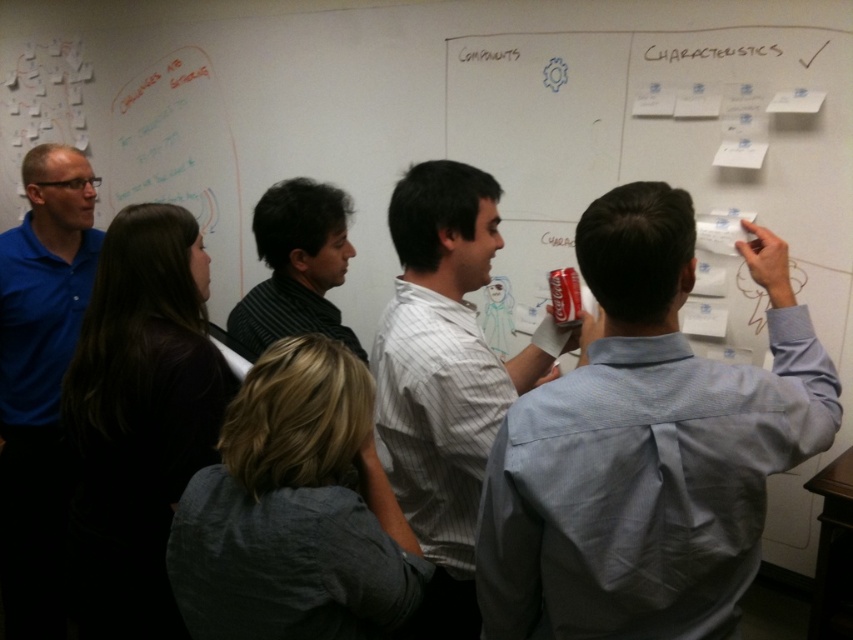
Is white striped shirt at center to the left of blue cotton polo shirt at left from the viewer's perspective?

In fact, white striped shirt at center is to the right of blue cotton polo shirt at left.

Is point (398, 216) positioned before point (33, 205)?

Yes, it is.

This screenshot has height=640, width=853. I want to click on white striped shirt at center, so click(x=444, y=376).

Between light blue shirt at center and gray cotton shirt at center, which one has more height?

With more height is light blue shirt at center.

Who is more forward, (x=554, y=484) or (x=389, y=611)?

Point (x=554, y=484) is in front.

The image size is (853, 640). In order to click on light blue shirt at center in this screenshot , I will do `click(647, 445)`.

Based on the photo, does light blue shirt at center have a lesser width compared to striped shirt at center?

No, light blue shirt at center is not thinner than striped shirt at center.

Locate an element on the screen. The width and height of the screenshot is (853, 640). light blue shirt at center is located at coordinates (647, 445).

The width and height of the screenshot is (853, 640). I want to click on light blue shirt at center, so click(x=647, y=445).

Image resolution: width=853 pixels, height=640 pixels. I want to click on light blue shirt at center, so click(647, 445).